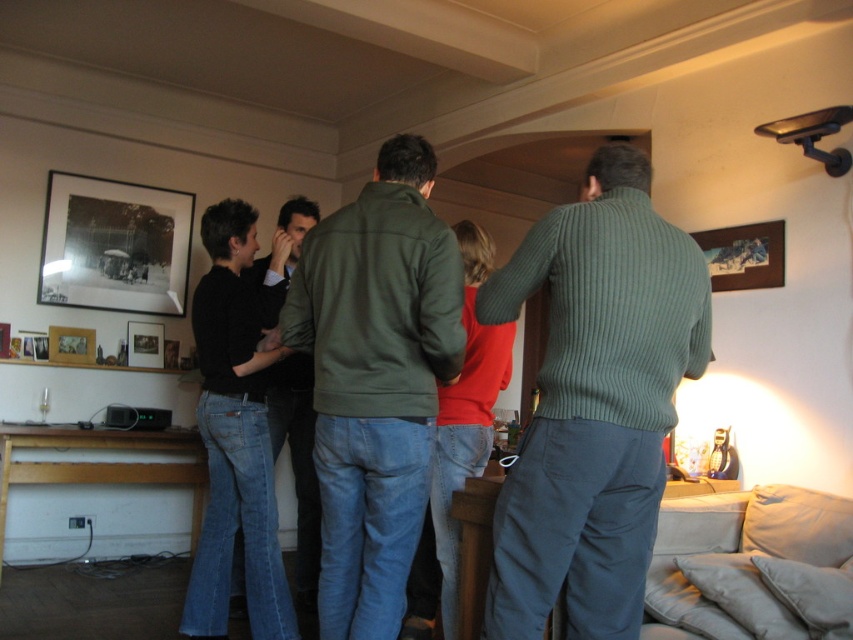
Does point (376, 484) come closer to viewer compared to point (146, 333)?

Yes, it is in front of point (146, 333).

Can you confirm if matte green jacket at center is positioned above matte black picture frame at upper left?

No, matte green jacket at center is not above matte black picture frame at upper left.

Where is `matte green jacket at center`? matte green jacket at center is located at coordinates (375, 380).

Who is taller, matte green jacket at center or black matte picture frame at upper left?

matte green jacket at center is taller.

Does point (343, 616) come farther from viewer compared to point (192, 202)?

That is False.

Locate an element on the screen. matte green jacket at center is located at coordinates (375, 380).

Is matte black picture frame at upper left wider than wooden picture frame at center?

Correct, the width of matte black picture frame at upper left exceeds that of wooden picture frame at center.

Is matte black picture frame at upper left positioned behind wooden picture frame at center?

Yes, matte black picture frame at upper left is further from the viewer.

Measure the distance between matte black picture frame at upper left and camera.

matte black picture frame at upper left is 4.66 meters from camera.

Locate an element on the screen. This screenshot has width=853, height=640. matte black picture frame at upper left is located at coordinates (144, 344).